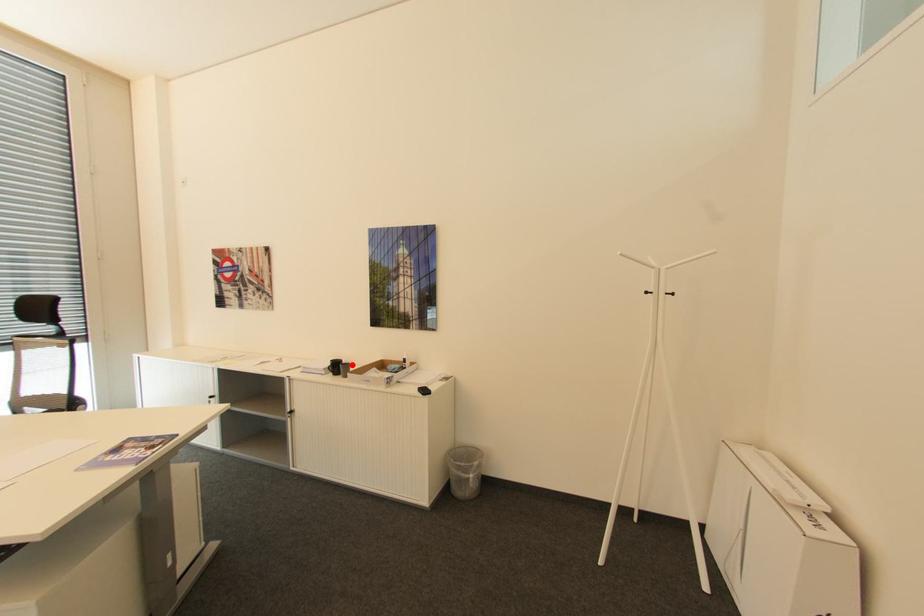
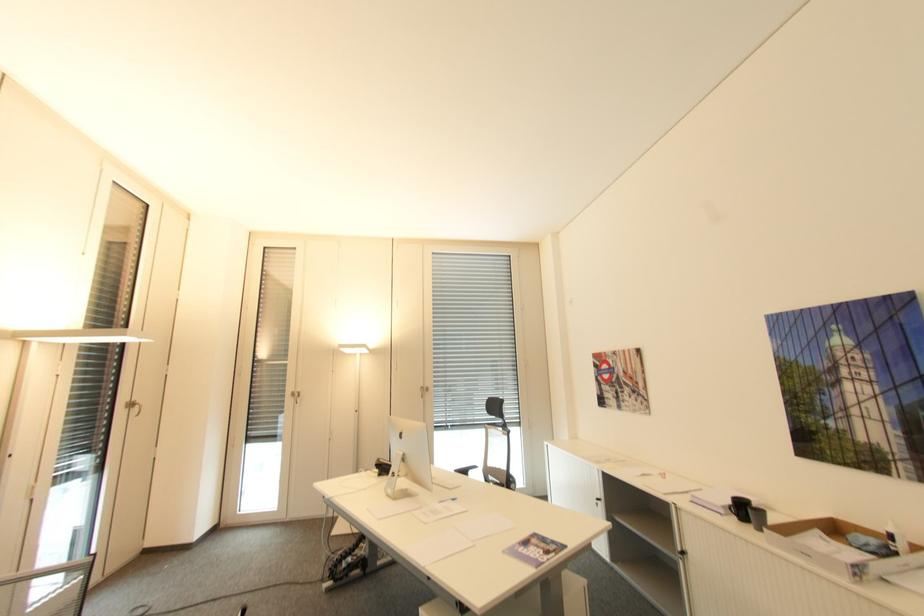
Question: I am providing you with two images of the same scene from different viewpoints. A red point is marked on the first image. Is the red point's position out of view in image 2?

Choices:
 (A) Yes
 (B) No

Answer: (B)